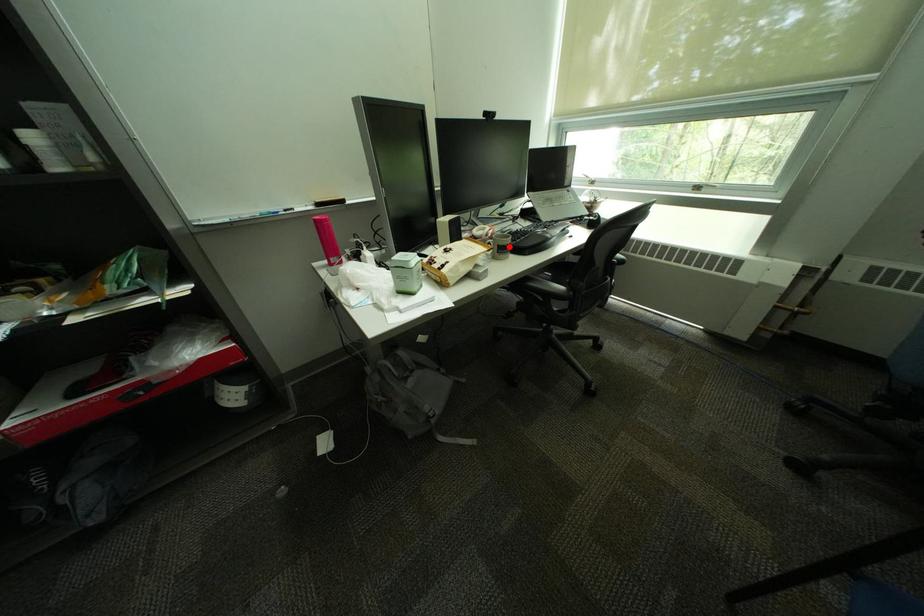
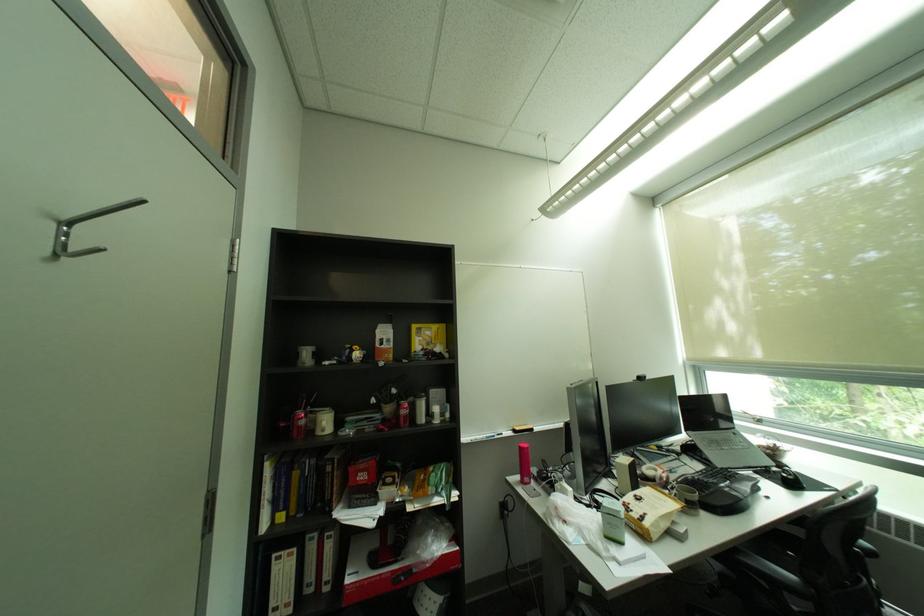
Where in the second image is the point corresponding to the highlighted location from the first image?

(697, 500)